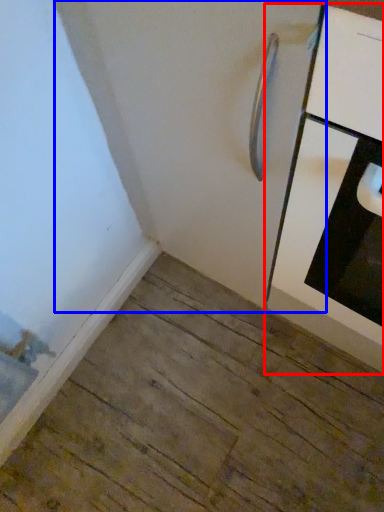
Question: Which object appears closest to the camera in this image, cabinetry (highlighted by a red box) or door (highlighted by a blue box)?

Choices:
 (A) cabinetry
 (B) door

Answer: (A)